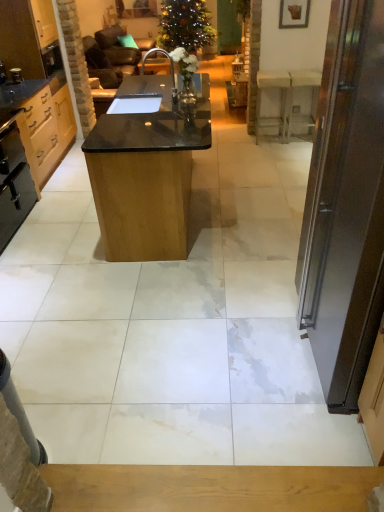
This screenshot has width=384, height=512. Describe the element at coordinates (40, 123) in the screenshot. I see `matte wood cabinet at left, acting as the second cabinetry starting from the top` at that location.

Measure the distance between point (135, 76) and camera.

6.87 meters.

Locate an element on the screen. metallic knob at left, positioned as the 2th appliance in bottom-to-top order is located at coordinates (16, 75).

You are a GUI agent. You are given a task and a screenshot of the screen. Output one action in this format:
    pyautogui.click(x=<x>, y=<y>)
    Task: Click on the light wood cabinet at left, which is the 2th cabinetry from bottom to top
    
    Given the screenshot: What is the action you would take?
    pyautogui.click(x=37, y=86)

Find the location of a particular element. This screenshot has height=512, width=384. green matte christmas tree at upper center is located at coordinates (185, 25).

Considering the relative sizes of white marble table at right, the 1th table from the right, and green matte christmas tree at upper center in the image provided, is white marble table at right, the 1th table from the right, shorter than green matte christmas tree at upper center?

Yes, white marble table at right, the 1th table from the right, is shorter than green matte christmas tree at upper center.

From the picture: From a real-world perspective, relative to green matte christmas tree at upper center, is white marble table at right, which ranks as the 1th table in back-to-front order, vertically above or below?

Clearly, from a real-world perspective, white marble table at right, which ranks as the 1th table in back-to-front order, is below green matte christmas tree at upper center.

Where is `the 1st table in front of the green matte christmas tree at upper center`? the 1st table in front of the green matte christmas tree at upper center is located at coordinates (284, 93).

Which object is thinner, black granite sink at center or light wood cabinet at left, which is the first cabinetry from top to bottom?

black granite sink at center is thinner.

Considering the relative positions of black granite sink at center and light wood cabinet at left, which is the first cabinetry from top to bottom, in the image provided, is black granite sink at center to the right of light wood cabinet at left, which is the first cabinetry from top to bottom, from the viewer's perspective?

Yes, black granite sink at center is to the right of light wood cabinet at left, which is the first cabinetry from top to bottom.

Is point (148, 108) closer or farther from the camera than point (36, 157)?

Point (148, 108).

Is black granite sink at center oriented towards light wood cabinet at left, which is the first cabinetry from top to bottom?

No, black granite sink at center does not turn towards light wood cabinet at left, which is the first cabinetry from top to bottom.

Where is `door positioned vertically above the white marble table at right, the 1th table from the right (from a real-world perspective)`? The width and height of the screenshot is (384, 512). door positioned vertically above the white marble table at right, the 1th table from the right (from a real-world perspective) is located at coordinates (345, 205).

From the image's perspective, between dark brown wooden door at right and white marble table at right, which ranks as the 1th table in back-to-front order, which one is located above?

white marble table at right, which ranks as the 1th table in back-to-front order.

Measure the distance between dark brown wooden door at right and white marble table at right, which is the 2th table in front-to-back order.

A distance of 10.86 feet exists between dark brown wooden door at right and white marble table at right, which is the 2th table in front-to-back order.

From a real-world perspective, is dark brown wooden door at right above or below white marble table at right, the 1th table from the right?

Clearly, from a real-world perspective, dark brown wooden door at right is above white marble table at right, the 1th table from the right.

Could you measure the distance between metallic knob at left, marked as the second appliance in a front-to-back arrangement, and green matte christmas tree at upper center?

A distance of 3.71 meters exists between metallic knob at left, marked as the second appliance in a front-to-back arrangement, and green matte christmas tree at upper center.

From a real-world perspective, who is located higher, metallic knob at left, the first appliance from the top, or green matte christmas tree at upper center?

metallic knob at left, the first appliance from the top, is physically above.

Are metallic knob at left, the first appliance from the top, and green matte christmas tree at upper center far apart?

Yes, metallic knob at left, the first appliance from the top, and green matte christmas tree at upper center are quite far apart.

Image resolution: width=384 pixels, height=512 pixels. In order to click on christmas tree that appears above the metallic knob at left, which ranks as the first appliance in back-to-front order (from the image's perspective) in this screenshot , I will do `click(185, 25)`.

Which is less distant, (22, 145) or (69, 121)?

Point (22, 145) is positioned closer to the camera compared to point (69, 121).

Based on the photo, from the image's perspective, is black matte oven at left, the first appliance positioned from the front, above or below matte wood cabinet at left, the 1th cabinetry in the bottom-to-top sequence?

black matte oven at left, the first appliance positioned from the front, is situated lower than matte wood cabinet at left, the 1th cabinetry in the bottom-to-top sequence, in the image.

Is the depth of black matte oven at left, the second appliance in the back-to-front sequence, less than that of matte wood cabinet at left, the 1th cabinetry in the bottom-to-top sequence?

Yes, it is in front of matte wood cabinet at left, the 1th cabinetry in the bottom-to-top sequence.

This screenshot has width=384, height=512. Identify the location of the 1st cabinetry positioned above the black matte oven at left, the 1th appliance from the bottom (from the image's perspective). (40, 123).

Can you confirm if black polished wood table at center, which is the first table from front to back, is thinner than dark brown wooden door at right?

In fact, black polished wood table at center, which is the first table from front to back, might be wider than dark brown wooden door at right.

Relative to dark brown wooden door at right, is black polished wood table at center, which is counted as the 2th table, starting from the back, in front or behind?

Clearly, black polished wood table at center, which is counted as the 2th table, starting from the back, is behind dark brown wooden door at right.

Which of these two, black polished wood table at center, which is counted as the 2th table, starting from the back, or dark brown wooden door at right, stands taller?

With more height is dark brown wooden door at right.

Which is correct: matte wood cabinet at left, the 1th cabinetry in the bottom-to-top sequence, is inside light wood cabinet at left, which is the first cabinetry from top to bottom, or outside of it?

matte wood cabinet at left, the 1th cabinetry in the bottom-to-top sequence, lies outside light wood cabinet at left, which is the first cabinetry from top to bottom.

Is matte wood cabinet at left, the 1th cabinetry in the bottom-to-top sequence, taller or shorter than light wood cabinet at left, which is the first cabinetry from top to bottom?

matte wood cabinet at left, the 1th cabinetry in the bottom-to-top sequence, is shorter than light wood cabinet at left, which is the first cabinetry from top to bottom.

Is matte wood cabinet at left, acting as the second cabinetry starting from the top, looking in the opposite direction of light wood cabinet at left, which is the 2th cabinetry from bottom to top?

That's not correct — matte wood cabinet at left, acting as the second cabinetry starting from the top, is not looking away from light wood cabinet at left, which is the 2th cabinetry from bottom to top.

Locate an element on the screen. The width and height of the screenshot is (384, 512). the 2nd table below the green matte christmas tree at upper center (from a real-world perspective) is located at coordinates tap(284, 93).

Where is `sink below the light wood cabinet at left, which is the first cabinetry from top to bottom (from the image's perspective)`? sink below the light wood cabinet at left, which is the first cabinetry from top to bottom (from the image's perspective) is located at coordinates (147, 89).

When comparing their distances from green matte christmas tree at upper center, does light wood cabinet at left, which is the 2th cabinetry from bottom to top, or matte wood cabinet at left, acting as the second cabinetry starting from the top, seem closer?

Based on the image, light wood cabinet at left, which is the 2th cabinetry from bottom to top, appears to be nearer to green matte christmas tree at upper center.

Considering their positions, is dark brown wooden door at right positioned closer to light wood cabinet at left, which is the first cabinetry from top to bottom, than white marble table at right, which ranks as the 1th table in back-to-front order?

Among the two, white marble table at right, which ranks as the 1th table in back-to-front order, is located nearer to light wood cabinet at left, which is the first cabinetry from top to bottom.

From the image, which object appears to be farther from black granite sink at center, metallic knob at left, marked as the second appliance in a front-to-back arrangement, or black polished wood table at center, which is counted as the first table, starting from the left?

black polished wood table at center, which is counted as the first table, starting from the left.

Looking at the image, which one is located closer to black matte oven at left, the 1th appliance from the bottom, green matte christmas tree at upper center or black polished wood table at center, which is the first table from front to back?

Among the two, black polished wood table at center, which is the first table from front to back, is located nearer to black matte oven at left, the 1th appliance from the bottom.

Which object lies further to the anchor point metallic knob at left, positioned as the 2th appliance in bottom-to-top order, black granite sink at center or black matte oven at left, the 2th appliance when ordered from top to bottom?

black granite sink at center lies further to metallic knob at left, positioned as the 2th appliance in bottom-to-top order, than the other object.

From the image, which object appears to be nearer to matte wood cabinet at left, acting as the second cabinetry starting from the top, light wood cabinet at left, which is the 2th cabinetry from bottom to top, or dark brown wooden door at right?

The object closer to matte wood cabinet at left, acting as the second cabinetry starting from the top, is light wood cabinet at left, which is the 2th cabinetry from bottom to top.

From the image, which object appears to be nearer to matte wood cabinet at left, the 1th cabinetry in the bottom-to-top sequence, dark brown wooden door at right or black polished wood table at center, which is counted as the first table, starting from the left?

black polished wood table at center, which is counted as the first table, starting from the left, is closer to matte wood cabinet at left, the 1th cabinetry in the bottom-to-top sequence.

Estimate the real-world distances between objects in this image. Which object is further from light wood cabinet at left, which is the 2th cabinetry from bottom to top, metallic knob at left, positioned as the 2th appliance in bottom-to-top order, or black matte oven at left, the 1th appliance from the bottom?

metallic knob at left, positioned as the 2th appliance in bottom-to-top order, lies further to light wood cabinet at left, which is the 2th cabinetry from bottom to top, than the other object.

This screenshot has height=512, width=384. In order to click on sink positioned between dark brown wooden door at right and matte wood cabinet at left, the 1th cabinetry in the bottom-to-top sequence, from near to far in this screenshot , I will do `click(147, 89)`.

Identify the location of sink between light wood cabinet at left, which is the 2th cabinetry from bottom to top, and white marble table at right, the 1th table from the right. The width and height of the screenshot is (384, 512). (147, 89).

Image resolution: width=384 pixels, height=512 pixels. I want to click on sink between matte wood cabinet at left, the 1th cabinetry in the bottom-to-top sequence, and black polished wood table at center, which is counted as the first table, starting from the left, in the horizontal direction, so click(x=147, y=89).

At what (x,y) coordinates should I click in order to perform the action: click on table situated between light wood cabinet at left, which is the first cabinetry from top to bottom, and white marble table at right, the 1th table from the right, from left to right. Please return your answer as a coordinate pair (x, y). Image resolution: width=384 pixels, height=512 pixels. Looking at the image, I should click on (145, 173).